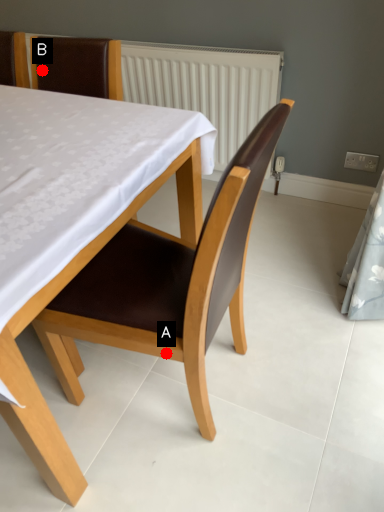
Question: Two points are circled on the image, labeled by A and B beside each circle. Which point is farther from the camera taking this photo?

Choices:
 (A) A is further
 (B) B is further

Answer: (B)